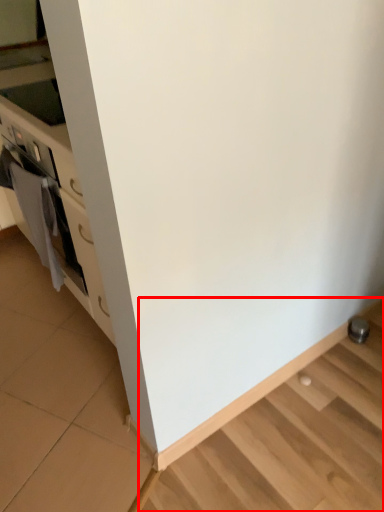
Question: From the image's perspective, what is the correct spatial positioning of stairwell (annotated by the red box) in reference to material?

Choices:
 (A) above
 (B) below

Answer: (B)